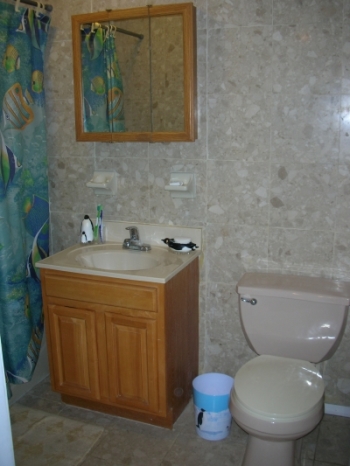
At what (x,y) coordinates should I click in order to perform the action: click on mirror. Please return your answer as a coordinate pair (x, y). This screenshot has height=466, width=350. Looking at the image, I should click on (119, 107).